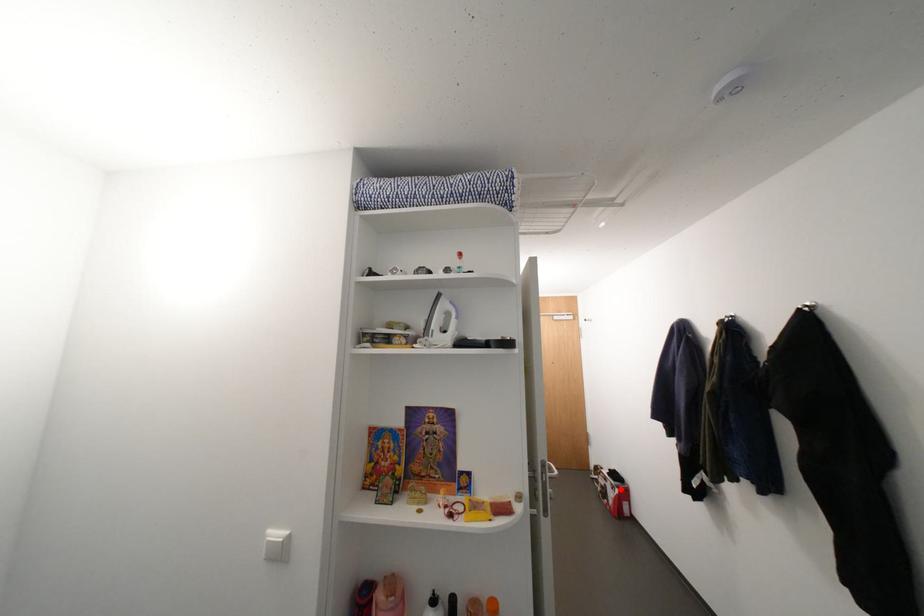
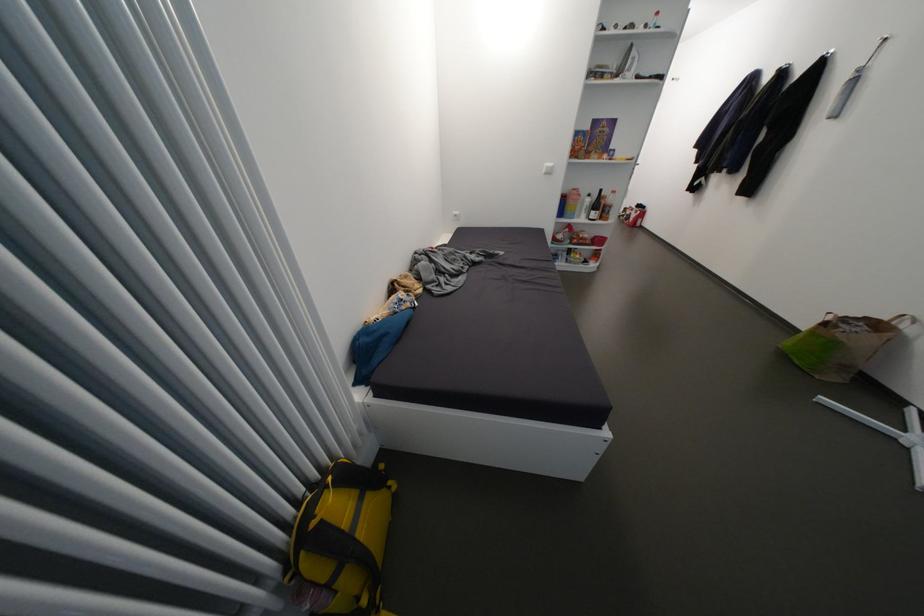
Locate, in the second image, the point that corresponds to the highlighted location in the first image.

(642, 214)